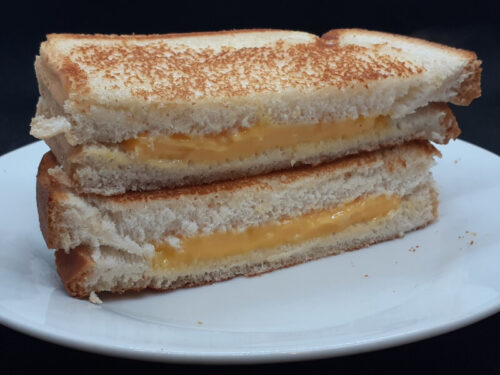
You are a GUI agent. You are given a task and a screenshot of the screen. Output one action in this format:
    pyautogui.click(x=<x>, y=<y>)
    Task: Click on the surface
    This screenshot has height=375, width=500.
    Given the screenshot: What is the action you would take?
    pyautogui.click(x=486, y=354)